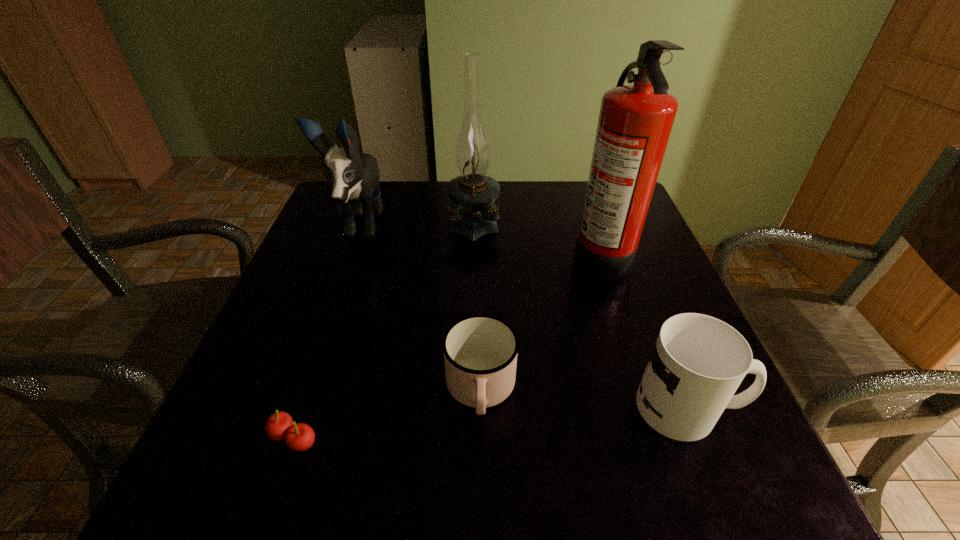
Identify the location of free space located on the front-facing side of the fire extinguisher. (445, 254).

I want to click on free space located 0.240m on the right of the oil lamp, so click(594, 220).

At what (x,y) coordinates should I click in order to perform the action: click on vacant space located 0.300m on the front-facing side of the puppy. Please return your answer as a coordinate pair (x, y). The height and width of the screenshot is (540, 960). Looking at the image, I should click on (304, 374).

This screenshot has height=540, width=960. I want to click on vacant space situated on the side of the fifth tallest object with the handle, so click(x=481, y=478).

Identify the location of vacant region located 0.240m on the right of the cherry. (479, 438).

At what (x,y) coordinates should I click in order to perform the action: click on fire extinguisher that is at the far edge. Please return your answer as a coordinate pair (x, y). The height and width of the screenshot is (540, 960). Looking at the image, I should click on (635, 121).

This screenshot has width=960, height=540. Identify the location of oil lamp present at the far edge. (475, 214).

The width and height of the screenshot is (960, 540). Find the location of `puppy situated at the far edge`. puppy situated at the far edge is located at coordinates (353, 176).

Locate an element on the screen. The image size is (960, 540). object that is at the near edge is located at coordinates (299, 437).

Where is `puppy present at the left edge`? Image resolution: width=960 pixels, height=540 pixels. puppy present at the left edge is located at coordinates (353, 176).